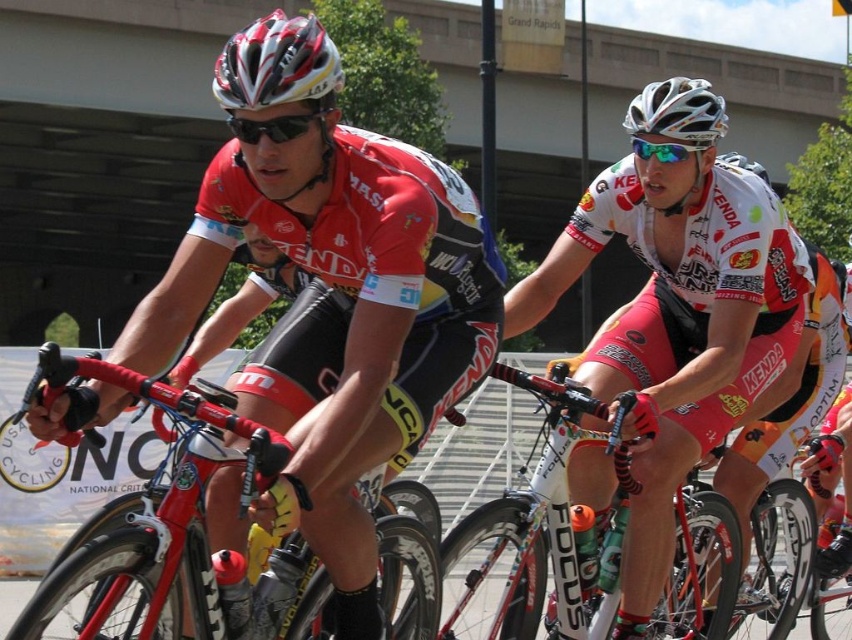
Question: Which point is closer to the camera?

Choices:
 (A) (545, 586)
 (B) (323, 58)
 (C) (210, 429)
 (D) (671, 124)

Answer: (C)

Question: Can you confirm if white matte helmet at upper center is positioned to the right of matte white and black helmet at upper center?

Choices:
 (A) no
 (B) yes

Answer: (B)

Question: Is matte black bicycle at center below matte white bicycle helmet at upper center?

Choices:
 (A) no
 (B) yes

Answer: (B)

Question: Is white glossy bicycle at center thinner than matte white and black helmet at upper center?

Choices:
 (A) yes
 (B) no

Answer: (B)

Question: Among these points, which one is farthest from the camera?

Choices:
 (A) (461, 275)
 (B) (72, 552)
 (C) (227, 99)

Answer: (B)

Question: Which of these objects is positioned closest to the white glossy bicycle at center?

Choices:
 (A) matte white and black helmet at upper center
 (B) matte white bicycle helmet at upper center
 (C) shiny red bicycle at left

Answer: (C)